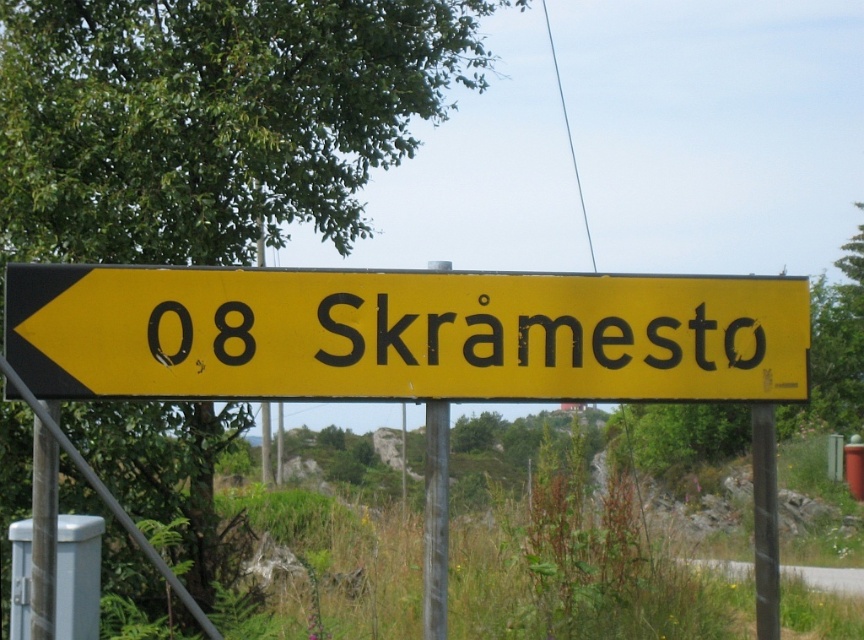
You are standing at the point marked by the coordinates (403, 333) in the image. What object is located exactly at that point?

The yellow matte sign at center is located exactly at point (403, 333).